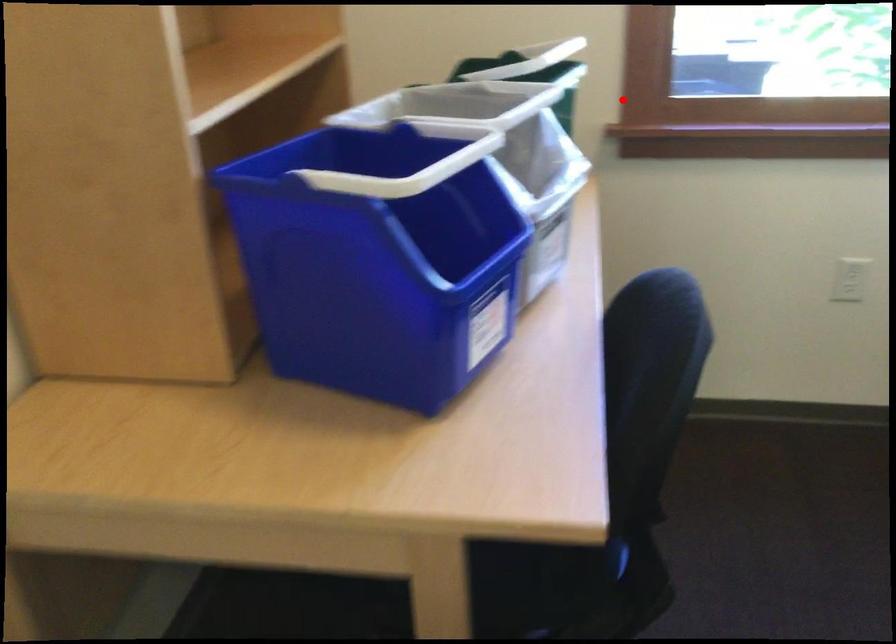
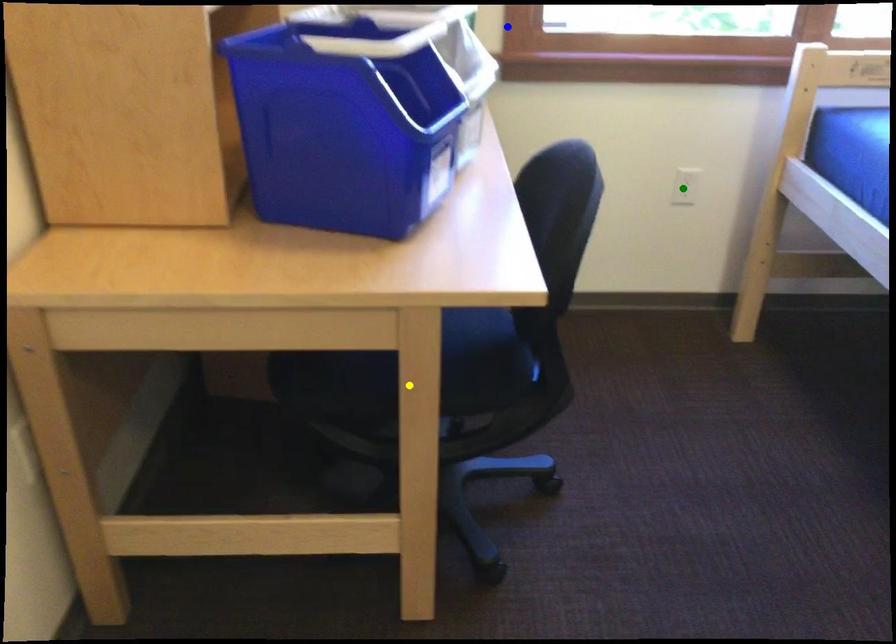
Question: I am providing you with two images of the same scene from different viewpoints. A red point is marked on the first image. You are given multiple points on the second image. Which spot in image 2 lines up with the point in image 1?

Choices:
 (A) yellow point
 (B) blue point
 (C) green point

Answer: (B)